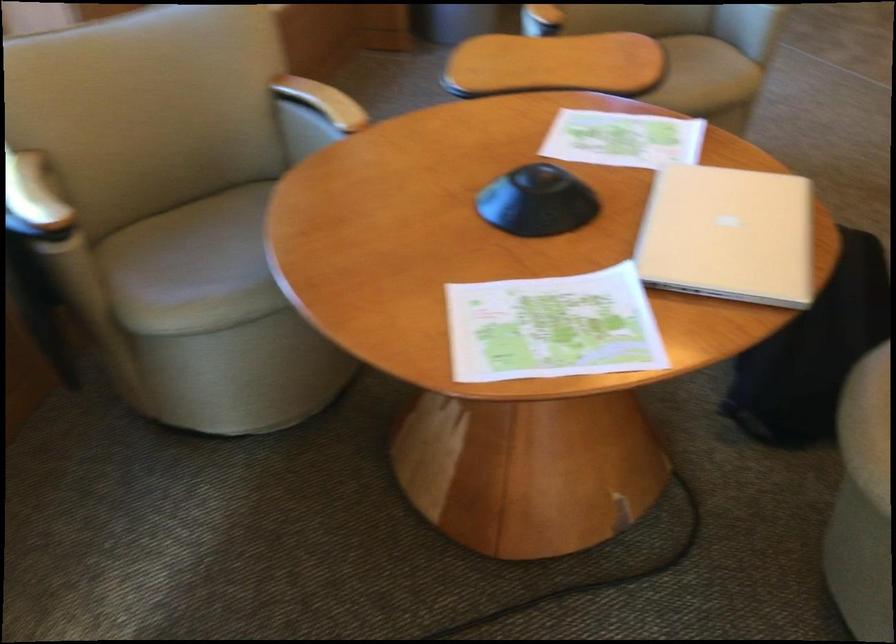
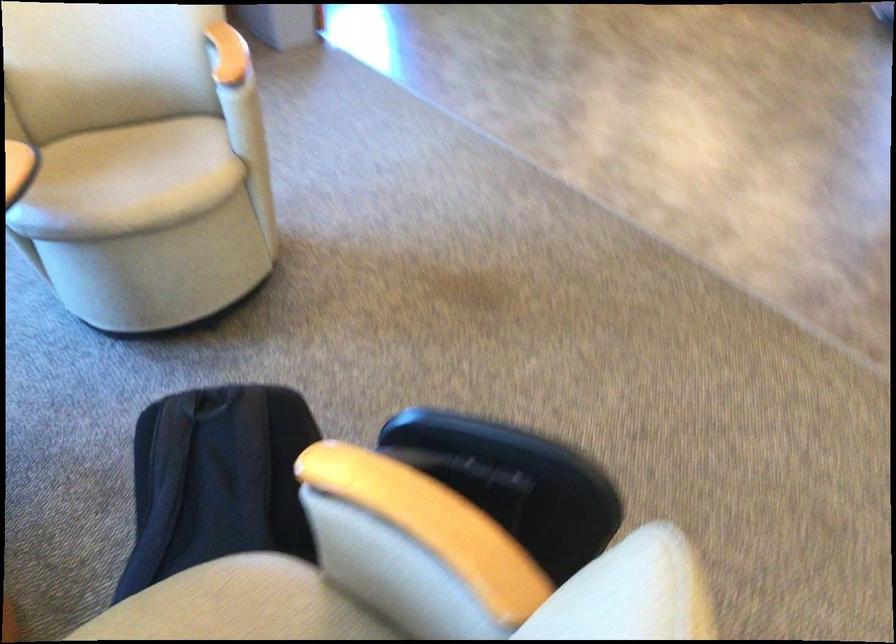
Question: Which direction would the cameraman need to move to produce the second image? Reply with the corresponding letter.

Choices:
 (A) Left
 (B) Right
 (C) Forward
 (D) Backward

Answer: (B)